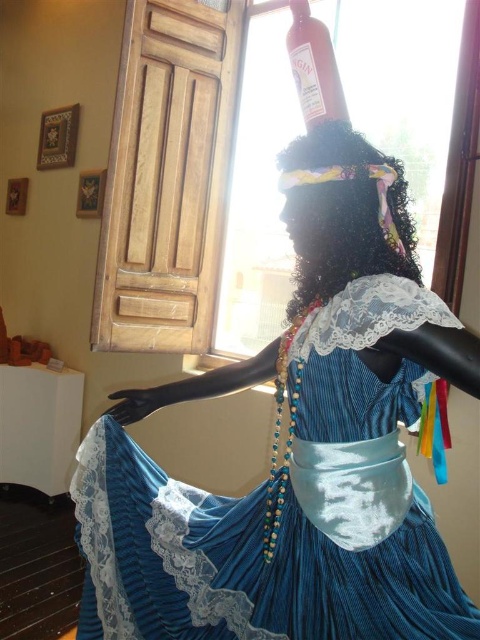
Question: Does blue velvet dress at center appear on the left side of matte glass bottle at upper center?

Choices:
 (A) yes
 (B) no

Answer: (A)

Question: Is blue velvet dress at center further to the viewer compared to matte glass bottle at upper center?

Choices:
 (A) no
 (B) yes

Answer: (A)

Question: Which object is closer to the camera taking this photo?

Choices:
 (A) blue velvet dress at center
 (B) matte glass bottle at upper center

Answer: (A)

Question: Among these objects, which one is farthest from the camera?

Choices:
 (A) matte glass bottle at upper center
 (B) blue velvet dress at center

Answer: (A)

Question: Is blue velvet dress at center further to the viewer compared to matte glass bottle at upper center?

Choices:
 (A) yes
 (B) no

Answer: (B)